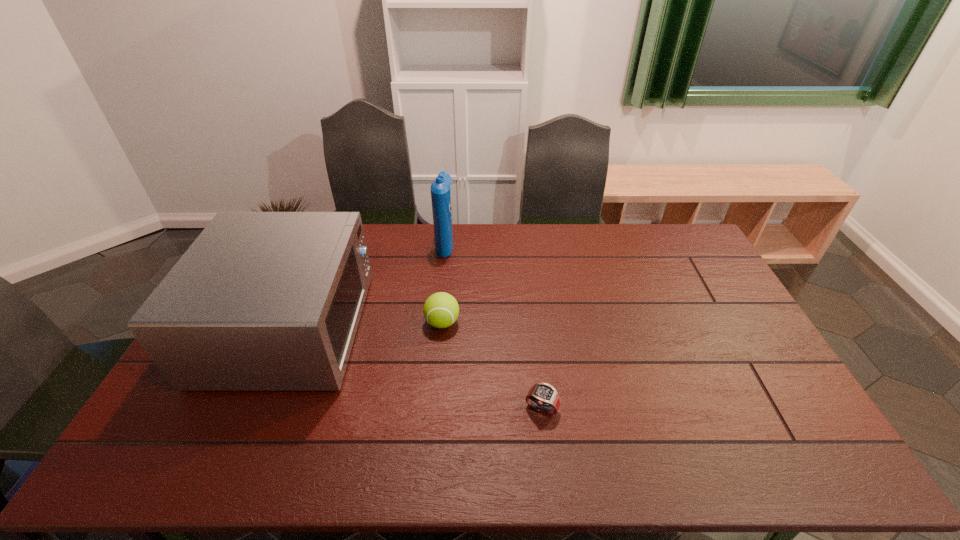
Where is `the farthest object`? This screenshot has height=540, width=960. the farthest object is located at coordinates (440, 189).

Locate an element on the screen. Image resolution: width=960 pixels, height=540 pixels. the leftmost object is located at coordinates (261, 301).

Locate an element on the screen. tennis ball is located at coordinates (x=441, y=310).

Image resolution: width=960 pixels, height=540 pixels. Find the location of `watch`. watch is located at coordinates (543, 397).

I want to click on the nearest object, so click(x=543, y=397).

Locate an element on the screen. vacant space located on the left of the shampoo is located at coordinates (395, 244).

Identify the location of free space located with the door open on the microwave oven. (449, 328).

Identify the location of vacant space positioned 0.190m on the front of the tennis ball. (437, 388).

This screenshot has height=540, width=960. Find the location of `vacant point located on the back of the shortest object`. vacant point located on the back of the shortest object is located at coordinates (537, 364).

The image size is (960, 540). What are the coordinates of `object that is positioned at the far edge` in the screenshot? It's located at (440, 189).